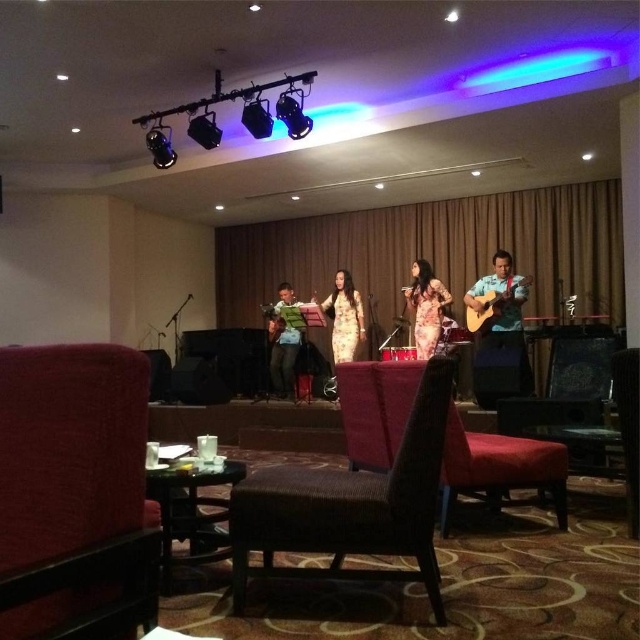
Based on the scene description, where is the dark brown woven armchair at center located in terms of coordinates?

The dark brown woven armchair at center is located at coordinates point (349, 506).

You are sitting in the dark brown woven armchair at center and want to hand a program to the person wearing the yellow satin dress at center. Can you reach them directly without getting up?

The dark brown woven armchair at center is closer to the viewer than the yellow satin dress at center, so you would need to reach across the space towards the dress, which is further away. However, without knowing the exact distance between them, it is uncertain if you can reach directly without getting up.